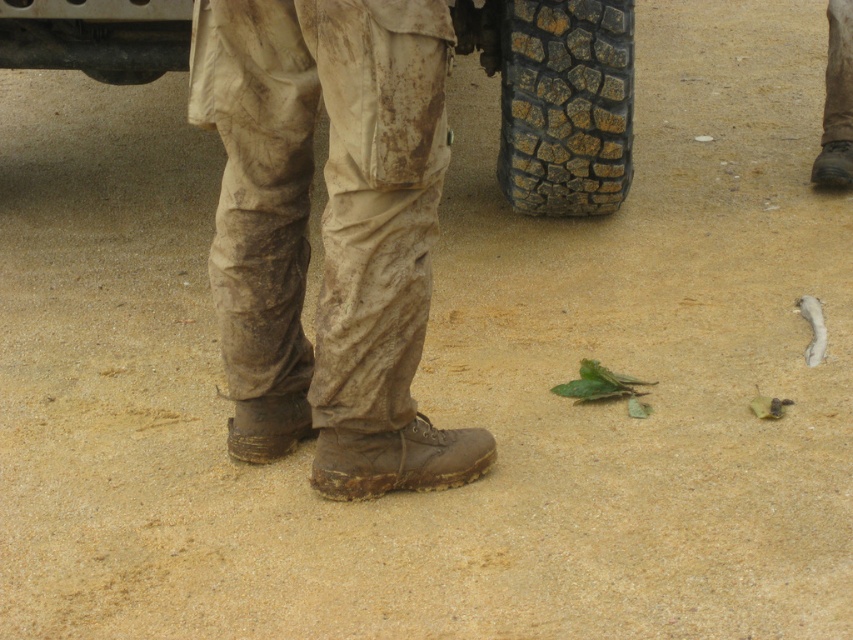
Measure the distance between rubber textured tire at upper center and camera.

They are 4.57 meters apart.

Does rubber textured tire at upper center appear on the right side of brown leather boot at right?

No, rubber textured tire at upper center is not to the right of brown leather boot at right.

Does point (19, 0) come in front of point (830, 184)?

Yes, point (19, 0) is closer to viewer.

Locate an element on the screen. rubber textured tire at upper center is located at coordinates (558, 99).

Does rubber textured tire at upper center have a lesser width compared to brown rugged boot at lower center?

→ No.

Where is `rubber textured tire at upper center`? This screenshot has height=640, width=853. rubber textured tire at upper center is located at coordinates (558, 99).

Describe the element at coordinates (558, 99) in the screenshot. The width and height of the screenshot is (853, 640). I see `rubber textured tire at upper center` at that location.

The height and width of the screenshot is (640, 853). Find the location of `rubber textured tire at upper center`. rubber textured tire at upper center is located at coordinates (558, 99).

Between brown leather boot at lower center and black rubber tire at lower center, which one has less height?

With less height is black rubber tire at lower center.

Is brown leather boot at lower center taller than black rubber tire at lower center?

Correct, brown leather boot at lower center is much taller as black rubber tire at lower center.

Image resolution: width=853 pixels, height=640 pixels. What do you see at coordinates (398, 460) in the screenshot? I see `brown leather boot at lower center` at bounding box center [398, 460].

Find the location of a particular element. This screenshot has height=640, width=853. brown leather boot at lower center is located at coordinates (398, 460).